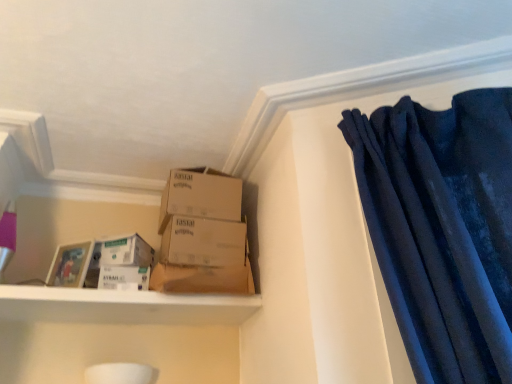
Question: Is brown cardboard box at center, the second box from the top, located outside white cardboard box at lower left, which is the 1th storage box in top-to-bottom order?

Choices:
 (A) yes
 (B) no

Answer: (A)

Question: Is brown cardboard box at center, which ranks as the first box in bottom-to-top order, wider than white cardboard box at lower left, placed as the 2th storage box when sorted from bottom to top?

Choices:
 (A) yes
 (B) no

Answer: (A)

Question: Considering the relative positions of brown cardboard box at center, the second box from the top, and white cardboard box at lower left, placed as the 2th storage box when sorted from bottom to top, in the image provided, is brown cardboard box at center, the second box from the top, to the right of white cardboard box at lower left, placed as the 2th storage box when sorted from bottom to top, from the viewer's perspective?

Choices:
 (A) yes
 (B) no

Answer: (A)

Question: Is brown cardboard box at center, the second box from the top, facing towards white cardboard box at lower left, placed as the 2th storage box when sorted from bottom to top?

Choices:
 (A) no
 (B) yes

Answer: (A)

Question: Does brown cardboard box at center, which ranks as the first box in bottom-to-top order, have a lesser width compared to white cardboard box at lower left, which is the 1th storage box in top-to-bottom order?

Choices:
 (A) no
 (B) yes

Answer: (A)

Question: In terms of height, does white cardboard box at lower left, which is the 1th storage box in top-to-bottom order, look taller or shorter compared to white cardboard box at lower left, which is counted as the second storage box, starting from the top?

Choices:
 (A) tall
 (B) short

Answer: (A)

Question: From a real-world perspective, relative to white cardboard box at lower left, which is counted as the second storage box, starting from the top, is white cardboard box at lower left, placed as the 2th storage box when sorted from bottom to top, vertically above or below?

Choices:
 (A) below
 (B) above

Answer: (B)

Question: Choose the correct answer: Is white cardboard box at lower left, placed as the 2th storage box when sorted from bottom to top, inside white cardboard box at lower left, which is counted as the second storage box, starting from the top, or outside it?

Choices:
 (A) inside
 (B) outside

Answer: (B)

Question: Is white cardboard box at lower left, placed as the 2th storage box when sorted from bottom to top, wider or thinner than white cardboard box at lower left, marked as the first storage box in a bottom-to-top arrangement?

Choices:
 (A) wide
 (B) thin

Answer: (A)

Question: From a real-world perspective, is white cardboard box at lower left, marked as the first storage box in a bottom-to-top arrangement, above or below white cardboard box at lower left, which is the 1th storage box in top-to-bottom order?

Choices:
 (A) below
 (B) above

Answer: (A)

Question: Would you say white cardboard box at lower left, marked as the first storage box in a bottom-to-top arrangement, is to the left or to the right of white cardboard box at lower left, which is the 1th storage box in top-to-bottom order, in the picture?

Choices:
 (A) left
 (B) right

Answer: (B)

Question: Which is correct: white cardboard box at lower left, marked as the first storage box in a bottom-to-top arrangement, is inside white cardboard box at lower left, which is the 1th storage box in top-to-bottom order, or outside of it?

Choices:
 (A) outside
 (B) inside

Answer: (A)

Question: In the image, is white cardboard box at lower left, marked as the first storage box in a bottom-to-top arrangement, positioned in front of or behind white cardboard box at lower left, placed as the 2th storage box when sorted from bottom to top?

Choices:
 (A) front
 (B) behind

Answer: (A)

Question: In the image, is brown cardboard box at center positioned in front of or behind white matte shelf at lower left?

Choices:
 (A) behind
 (B) front

Answer: (A)

Question: From the image's perspective, is brown cardboard box at center located above or below white matte shelf at lower left?

Choices:
 (A) above
 (B) below

Answer: (A)